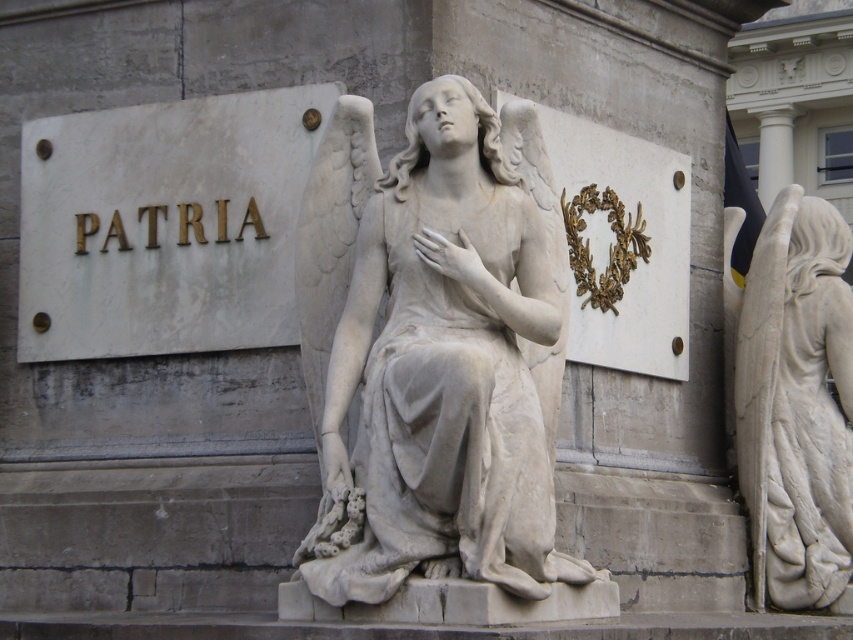
Question: Which point is farther from the camera taking this photo?

Choices:
 (A) (32, 189)
 (B) (815, 604)
 (C) (299, 236)

Answer: (B)

Question: Does white marble sign at upper left have a larger size compared to white marble statue at right?

Choices:
 (A) yes
 (B) no

Answer: (A)

Question: Which point is farther to the camera?

Choices:
 (A) white marble statue at center
 (B) white marble statue at right
 (C) white marble sign at upper left

Answer: (B)

Question: Is white marble statue at center to the right of white marble statue at right from the viewer's perspective?

Choices:
 (A) yes
 (B) no

Answer: (B)

Question: Which is farther from the white marble statue at center?

Choices:
 (A) white marble sign at upper left
 (B) white marble statue at right

Answer: (B)

Question: Observing the image, what is the correct spatial positioning of white marble statue at center in reference to white marble sign at upper left?

Choices:
 (A) above
 (B) below

Answer: (B)